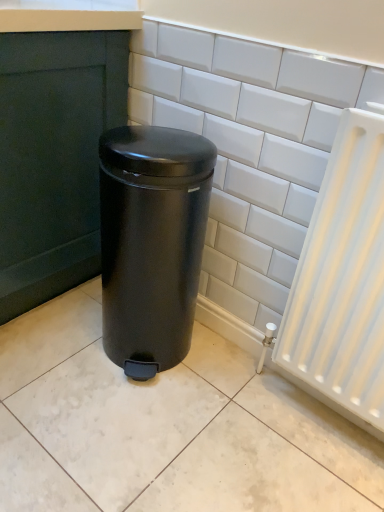
Identify the location of free location in front of matte black trash can at center. (130, 422).